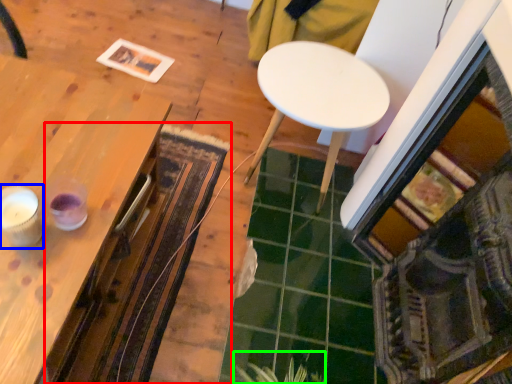
Question: Which is nearer to the mat (highlighted by a red box)? candle holder (highlighted by a blue box) or plant (highlighted by a green box).

Choices:
 (A) candle holder
 (B) plant

Answer: (B)